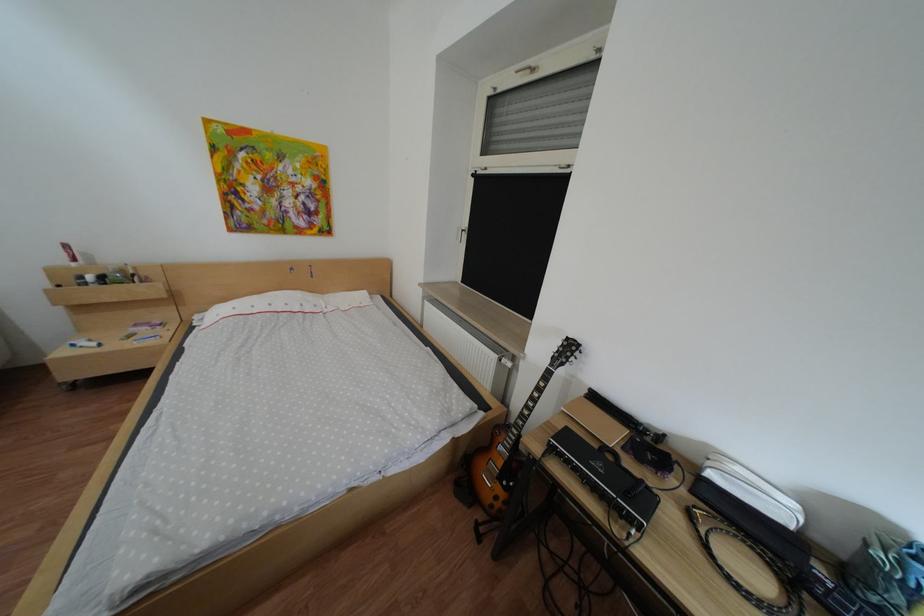
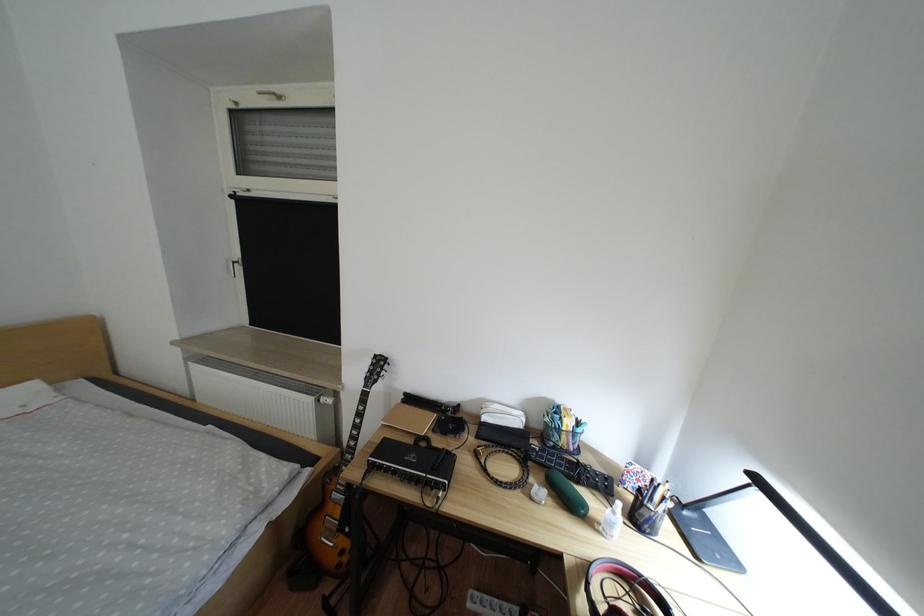
Locate, in the second image, the point that corresponds to point 708,493 in the first image.

(492, 438)